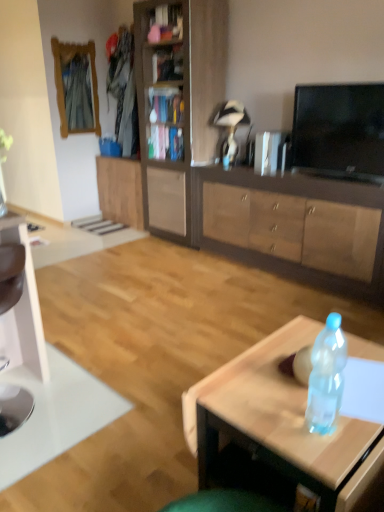
Where is `vacant region under white glossy computer desk at left (from a real-world perspective)`? The height and width of the screenshot is (512, 384). vacant region under white glossy computer desk at left (from a real-world perspective) is located at coordinates (27, 407).